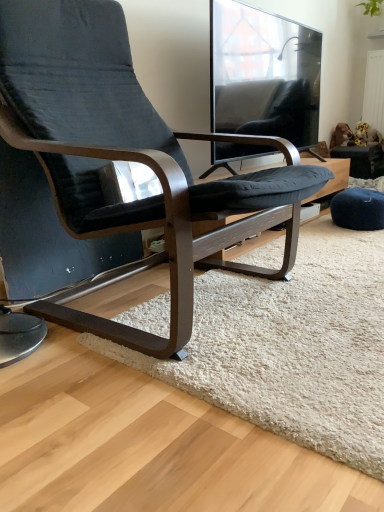
Question: Looking at the image, does white textured radiator at upper right seem bigger or smaller compared to matte black chair at center?

Choices:
 (A) big
 (B) small

Answer: (B)

Question: Is white textured radiator at upper right spatially inside matte black chair at center, or outside of it?

Choices:
 (A) outside
 (B) inside

Answer: (A)

Question: Which object is positioned farthest from the white shaggy rug at center?

Choices:
 (A) transparent glass window at upper center
 (B) white textured radiator at upper right
 (C) matte black chair at center

Answer: (B)

Question: Which object is positioned farthest from the white textured radiator at upper right?

Choices:
 (A) matte black chair at center
 (B) transparent glass window at upper center
 (C) white shaggy rug at center

Answer: (A)